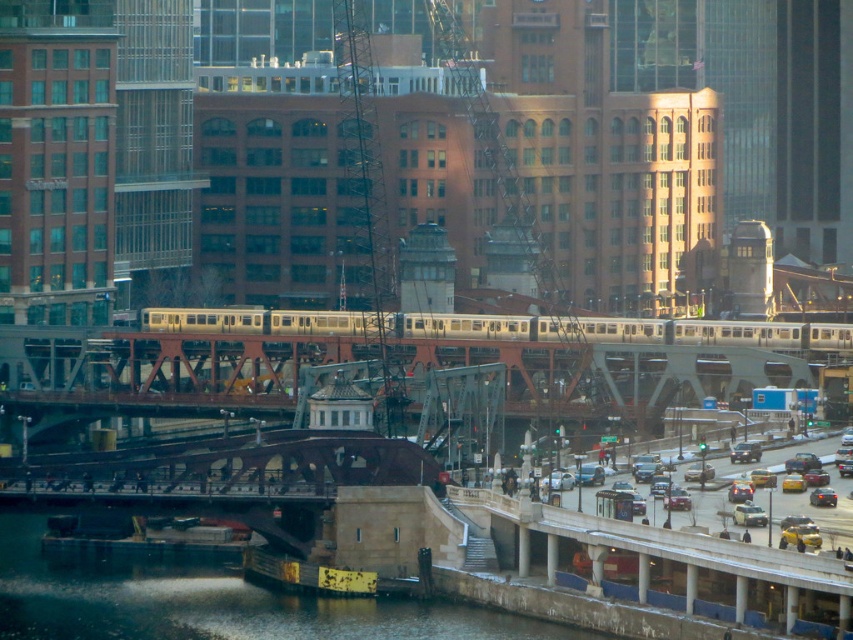
From the picture: You are standing at the point marked as point (207, 602). What is the closest object to you?

The closest object to you is the dark gray concrete river at lower left located at point (207, 602).

You are standing at the point marked by the coordinates point [207,602] in the image. What is the object located at this point?

The point [207,602] indicates dark gray concrete river at lower left.

You are a city planner analyzing the image. The dark gray concrete river at lower left and the yellow metallic taxi at lower right are both in the foreground. Which object occupies more horizontal space in the image?

The dark gray concrete river at lower left occupies more horizontal space in the image because its width is larger than that of the yellow metallic taxi at lower right.